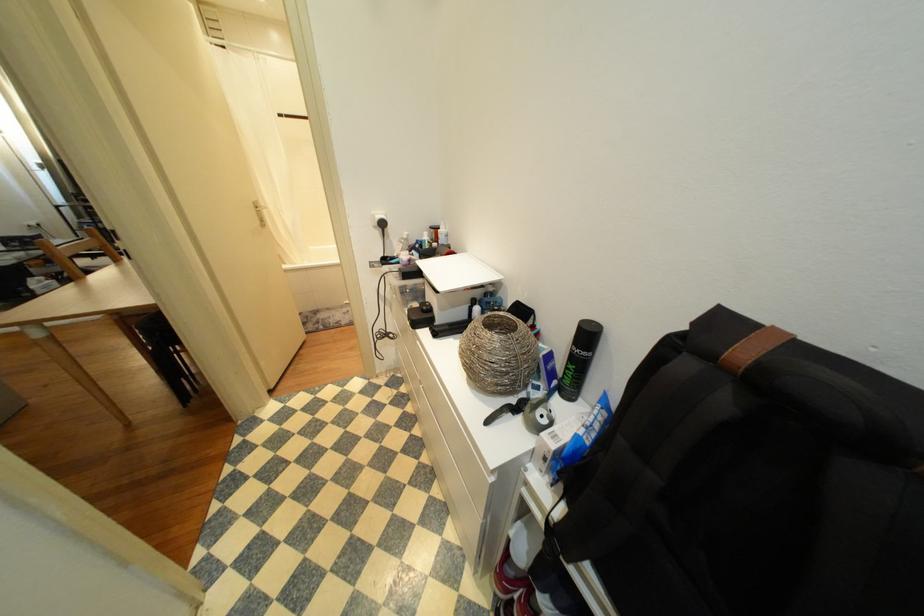
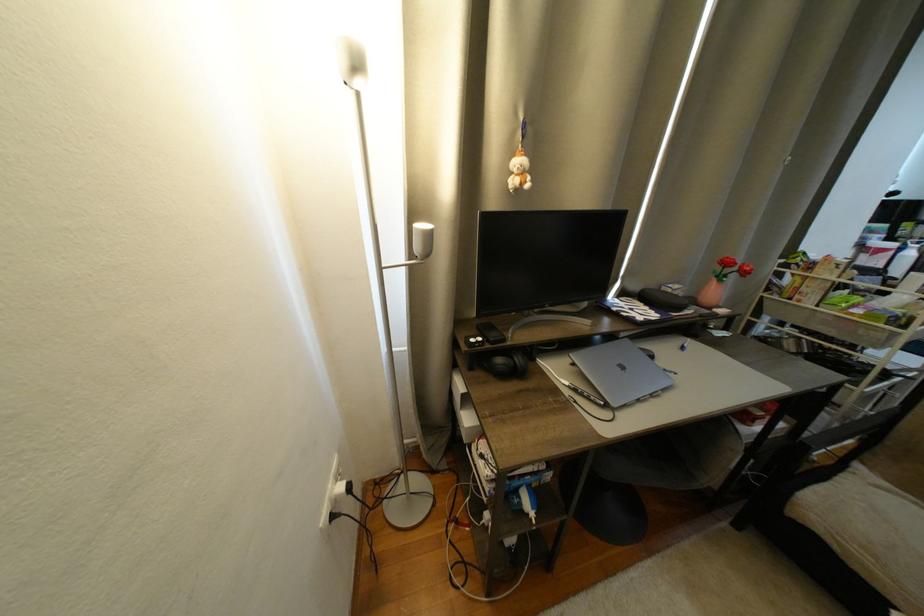
Locate, in the second image, the point that corresponds to (x=47, y=225) in the first image.

(358, 490)